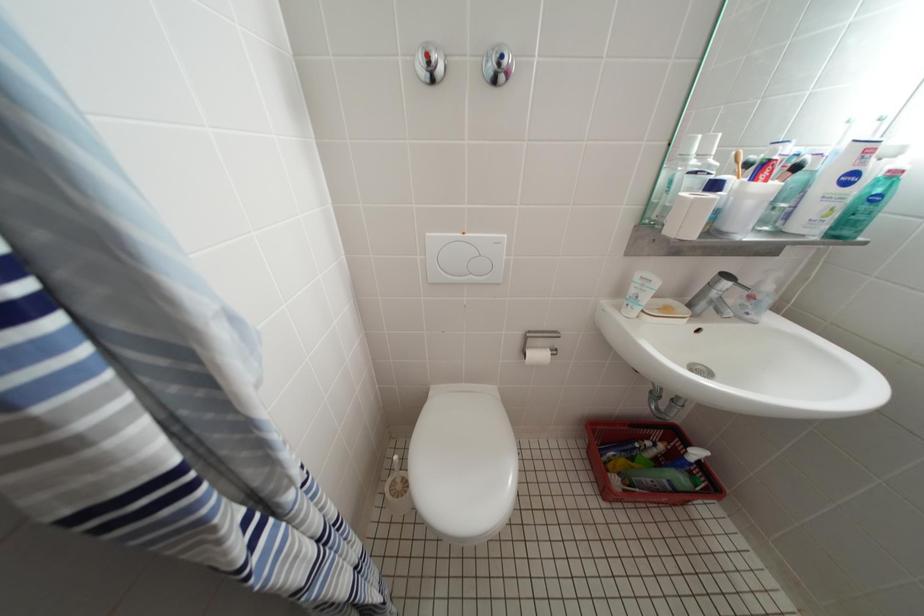
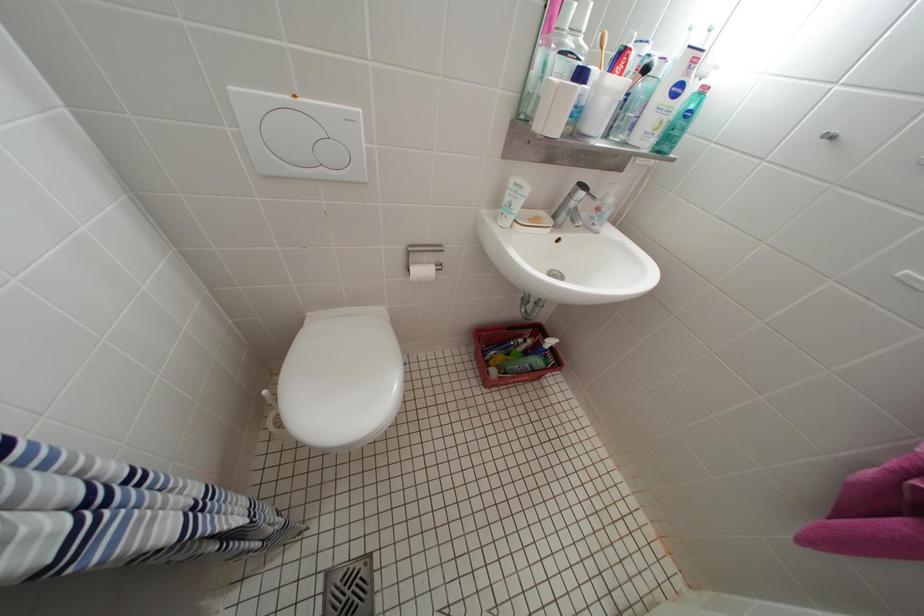
Question: In a continuous first-person perspective shot, in which direction is the camera moving?

Choices:
 (A) Left
 (B) Right
 (C) Forward
 (D) Backward

Answer: (B)